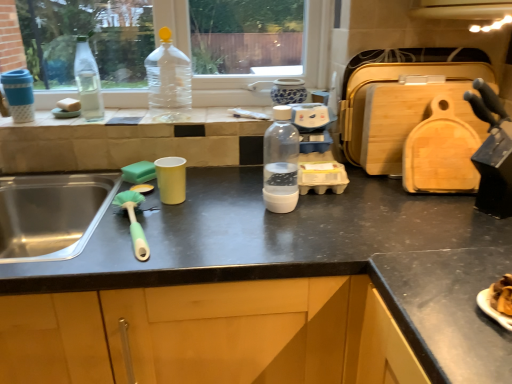
The width and height of the screenshot is (512, 384). In order to click on free space above translucent glass bottle at upper center (from a real-world perspective) in this screenshot , I will do `click(108, 115)`.